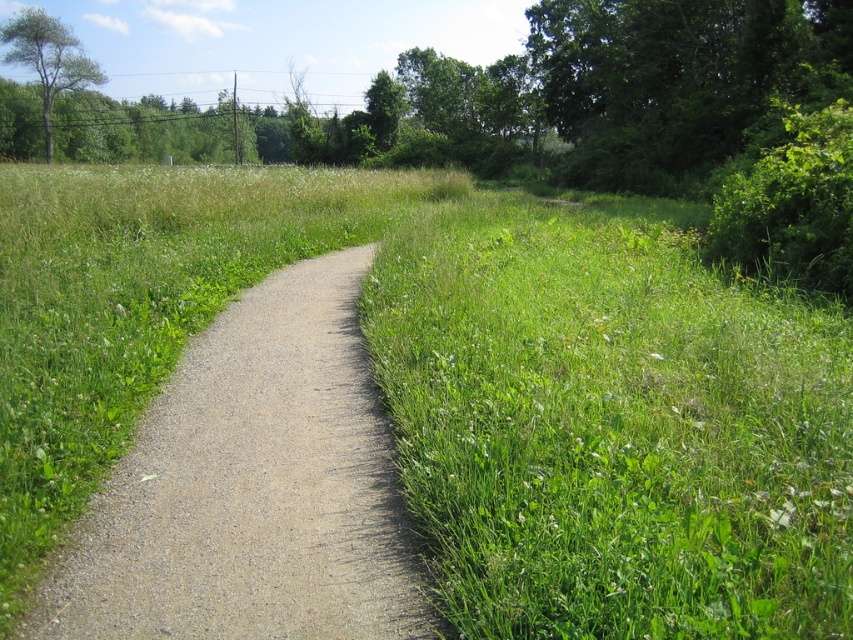
You are standing at the starting point of the path and want to walk along the gray gravel path at center. According to the coordinates provided, in which direction should you head to stay on the path?

The gray gravel path at center is located at point 0.764 on the x and 0.295 on the y. Since the path is at center, you should head towards the center direction to stay on the path.

You are a hiker planning to walk along the gray gravel path at center. You notice the green leafy tree at upper left. Which direction should you look to see the tree while standing on the path?

The gray gravel path at center is located below the green leafy tree at upper left, so you should look upward and toward the left side to see the tree while standing on the path.

You are a gardener who needs to mow the gray gravel path at center and the green leafy tree at upper left. Since your lawnmower can only handle areas narrower than 2 meters, will you be able to mow both areas without difficulty?

The gray gravel path at center is narrower than the green leafy tree at upper left. However, the exact width of the path isn